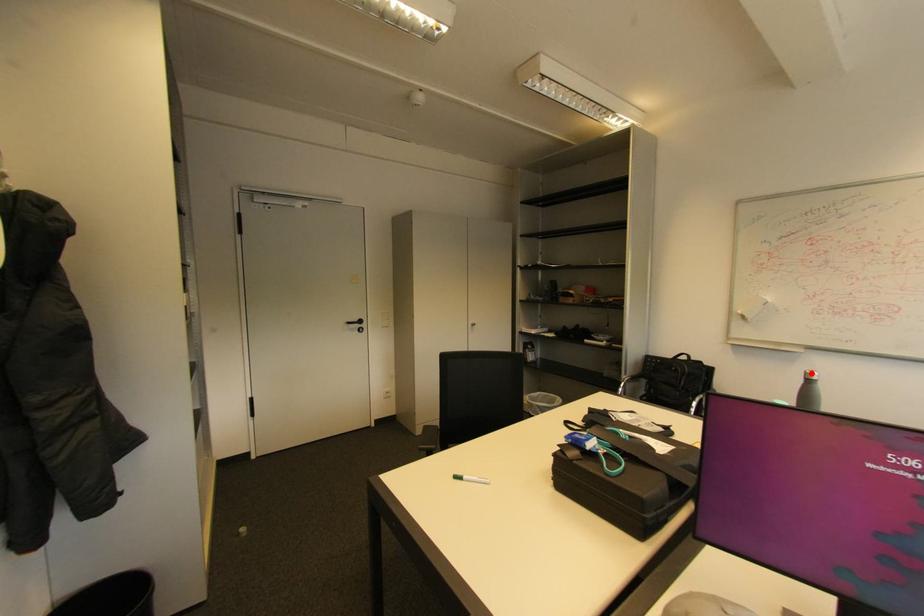
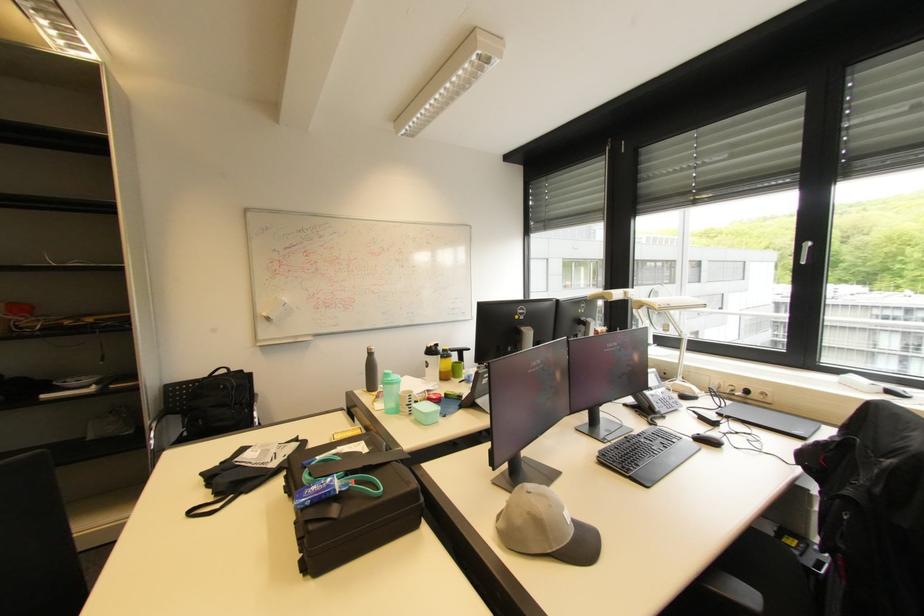
Where in the second image is the point corresponding to the highlighted location from the first image?

(372, 350)